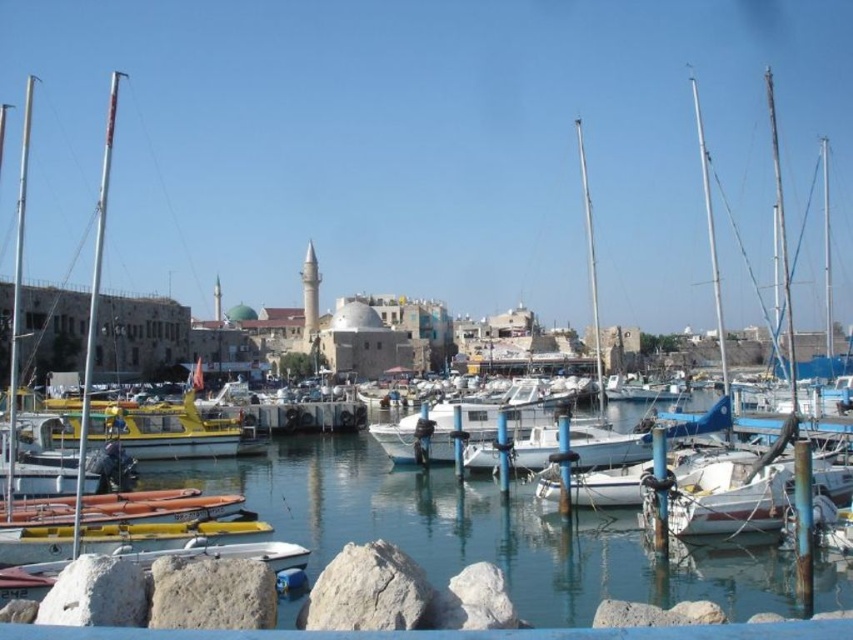
Between point (131, 440) and point (242, 621), which one is positioned in front?

Positioned in front is point (242, 621).

Locate an element on the screen. This screenshot has width=853, height=640. yellow matte boat at center is located at coordinates (164, 429).

Is point (140, 448) in front of point (178, 612)?

That is False.

Where is `yellow matte boat at center`? This screenshot has height=640, width=853. yellow matte boat at center is located at coordinates (164, 429).

I want to click on rough textured rock at lower center, so 367,589.

Who is more distant from viewer, (357, 560) or (146, 406)?

The point (146, 406) is behind.

Who is more forward, (331, 589) or (148, 433)?

Point (331, 589) is more forward.

Where is `rough textured rock at lower center`? The width and height of the screenshot is (853, 640). rough textured rock at lower center is located at coordinates (x=367, y=589).

Is point (654, 600) closer to viewer compared to point (166, 582)?

No, (654, 600) is further to viewer.

Is clear blue water at center above gray rough stone at lower left?

Incorrect, clear blue water at center is not positioned above gray rough stone at lower left.

Which is behind, point (374, 451) or point (149, 604)?

The point (374, 451) is more distant.

This screenshot has width=853, height=640. Find the location of `clear blue water at center`. clear blue water at center is located at coordinates (482, 531).